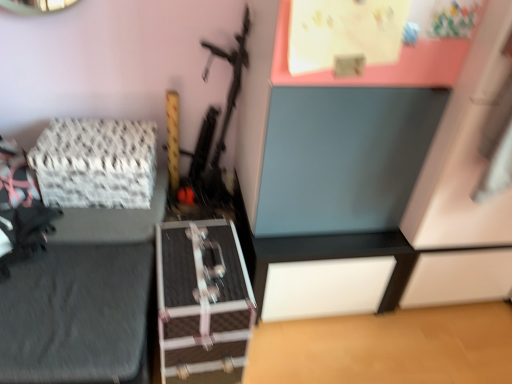
Where is `matte blue drawer at upper center`? The width and height of the screenshot is (512, 384). matte blue drawer at upper center is located at coordinates click(369, 191).

What do you see at coordinates (369, 191) in the screenshot?
I see `matte blue drawer at upper center` at bounding box center [369, 191].

The width and height of the screenshot is (512, 384). I want to click on white woven fabric at left, so click(x=96, y=163).

Image resolution: width=512 pixels, height=384 pixels. What do you see at coordinates (96, 163) in the screenshot?
I see `white woven fabric at left` at bounding box center [96, 163].

Image resolution: width=512 pixels, height=384 pixels. I want to click on matte blue drawer at upper center, so click(369, 191).

Considering the relative positions of white woven fabric at left and matte blue drawer at upper center in the image provided, is white woven fabric at left to the left or to the right of matte blue drawer at upper center?

Clearly, white woven fabric at left is on the left of matte blue drawer at upper center in the image.

Is the depth of white woven fabric at left less than that of matte blue drawer at upper center?

That is False.

Is point (83, 129) farther from viewer compared to point (469, 73)?

Yes.

From the image's perspective, would you say white woven fabric at left is positioned over matte blue drawer at upper center?

Incorrect, from the image's perspective, white woven fabric at left is lower than matte blue drawer at upper center.

From a real-world perspective, is white woven fabric at left above or below matte blue drawer at upper center?

In terms of real-world spatial position, white woven fabric at left is below matte blue drawer at upper center.

Considering the sizes of objects white woven fabric at left and matte blue drawer at upper center in the image provided, who is wider, white woven fabric at left or matte blue drawer at upper center?

matte blue drawer at upper center is wider.

Considering the sizes of white woven fabric at left and matte blue drawer at upper center in the image, is white woven fabric at left taller or shorter than matte blue drawer at upper center?

Clearly, white woven fabric at left is shorter compared to matte blue drawer at upper center.

In the scene shown: Between white woven fabric at left and matte blue drawer at upper center, which one has smaller size?

white woven fabric at left is smaller.

Does white woven fabric at left contain matte blue drawer at upper center?

Actually, matte blue drawer at upper center is outside white woven fabric at left.

Are white woven fabric at left and matte blue drawer at upper center making contact?

No, white woven fabric at left is not making contact with matte blue drawer at upper center.

Is white woven fabric at left aimed at matte blue drawer at upper center?

No, white woven fabric at left is not turned towards matte blue drawer at upper center.

How many degrees apart are the facing directions of white woven fabric at left and matte blue drawer at upper center?

The angular difference between white woven fabric at left and matte blue drawer at upper center is 5.74 degrees.

Identify the location of dresser that appears on the right of white woven fabric at left. Image resolution: width=512 pixels, height=384 pixels. [369, 191].

Considering the positions of objects matte blue drawer at upper center and white woven fabric at left in the image provided, who is more to the right, matte blue drawer at upper center or white woven fabric at left?

Positioned to the right is matte blue drawer at upper center.

Which object is closer to the camera taking this photo, matte blue drawer at upper center or white woven fabric at left?

matte blue drawer at upper center.

Is point (285, 289) positioned in front of point (38, 144)?

No, (285, 289) is further to viewer.

From the image's perspective, is matte blue drawer at upper center located beneath white woven fabric at left?

No.

From a real-world perspective, is matte blue drawer at upper center below white woven fabric at left?

Actually, matte blue drawer at upper center is physically above white woven fabric at left in the real world.

Can you confirm if matte blue drawer at upper center is thinner than white woven fabric at left?

No, matte blue drawer at upper center is not thinner than white woven fabric at left.

Who is taller, matte blue drawer at upper center or white woven fabric at left?

matte blue drawer at upper center is taller.

Based on their sizes in the image, would you say matte blue drawer at upper center is bigger or smaller than white woven fabric at left?

matte blue drawer at upper center is bigger than white woven fabric at left.

Is matte blue drawer at upper center inside the boundaries of white woven fabric at left, or outside?

matte blue drawer at upper center lies outside white woven fabric at left.

Is matte blue drawer at upper center not near white woven fabric at left?

No, matte blue drawer at upper center is in close proximity to white woven fabric at left.

Is matte blue drawer at upper center facing away from white woven fabric at left?

No, matte blue drawer at upper center is not facing the opposite direction of white woven fabric at left.

The width and height of the screenshot is (512, 384). What are the coordinates of `dresser above the white woven fabric at left (from the image's perspective)` in the screenshot? It's located at (369, 191).

I want to click on dresser on the right of white woven fabric at left, so click(x=369, y=191).

Identify the location of dresser located above the white woven fabric at left (from the image's perspective). The width and height of the screenshot is (512, 384). (369, 191).